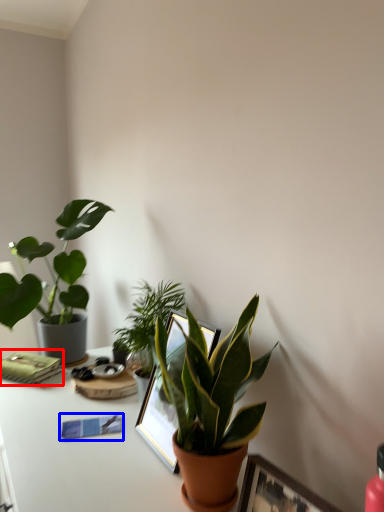
Question: Which object appears farthest to the camera in this image, paperback book (highlighted by a red box) or journal (highlighted by a blue box)?

Choices:
 (A) paperback book
 (B) journal

Answer: (A)